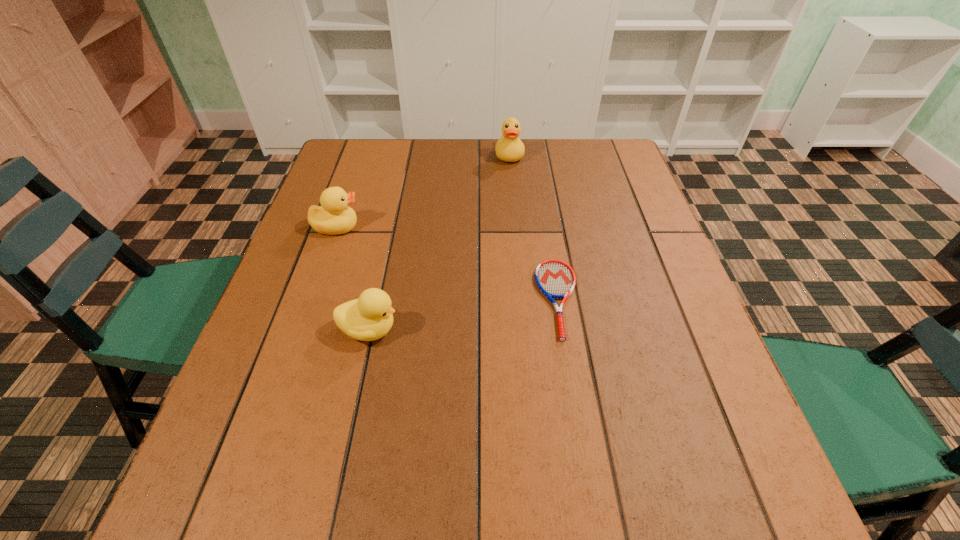
Identify the location of free point that satisfies the following two spatial constraints: 1. at the beak of the farthest object; 2. on the left side of the tennis racket. (522, 299).

This screenshot has height=540, width=960. I want to click on free space that satisfies the following two spatial constraints: 1. at the beak of the rightmost duck; 2. at the beak of the second farthest object, so click(516, 227).

Find the location of a particular element. The width and height of the screenshot is (960, 540). vacant space that satisfies the following two spatial constraints: 1. at the beak of the leftmost duck; 2. on the left side of the shortest object is located at coordinates (312, 299).

You are a GUI agent. You are given a task and a screenshot of the screen. Output one action in this format:
    pyautogui.click(x=<x>, y=<y>)
    Task: Click on the blank area in the image that satisfies the following two spatial constraints: 1. at the beak of the farthest object; 2. at the beak of the third nearest object
    This screenshot has width=960, height=540.
    Given the screenshot: What is the action you would take?
    pyautogui.click(x=516, y=227)

Locate an element on the screen. The image size is (960, 540). free space that satisfies the following two spatial constraints: 1. at the beak of the shortest object; 2. on the left side of the second farthest duck is located at coordinates (312, 299).

You are a GUI agent. You are given a task and a screenshot of the screen. Output one action in this format:
    pyautogui.click(x=<x>, y=<y>)
    Task: Click on the vacant position in the image that satisfies the following two spatial constraints: 1. at the beak of the farthest duck; 2. on the right side of the shortest object
    The width and height of the screenshot is (960, 540).
    Given the screenshot: What is the action you would take?
    pyautogui.click(x=522, y=299)

Identify the location of free location that satisfies the following two spatial constraints: 1. at the beak of the farthest object; 2. on the front-facing side of the nearest duck. Image resolution: width=960 pixels, height=540 pixels. (524, 330).